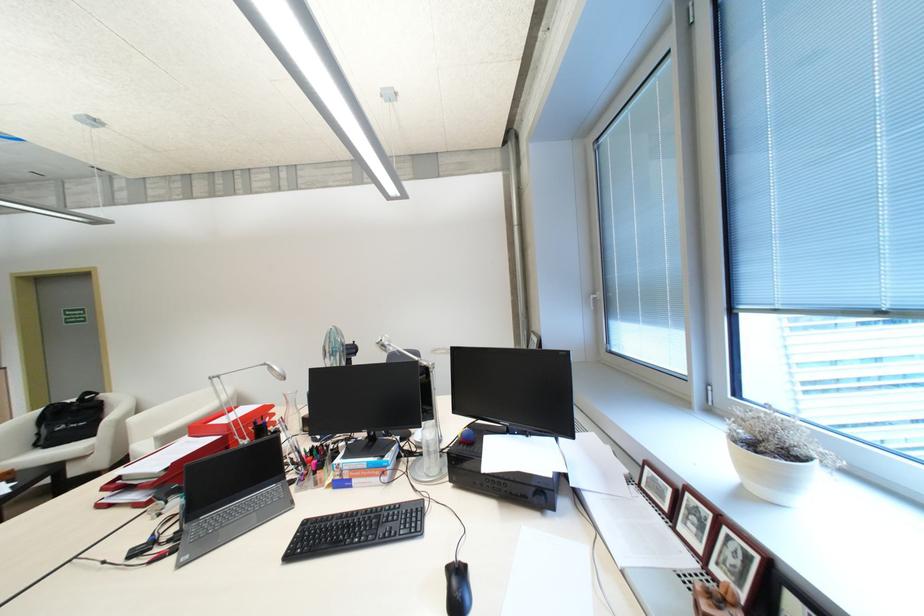
This screenshot has width=924, height=616. What do you see at coordinates (52, 455) in the screenshot?
I see `the chair sitting surface` at bounding box center [52, 455].